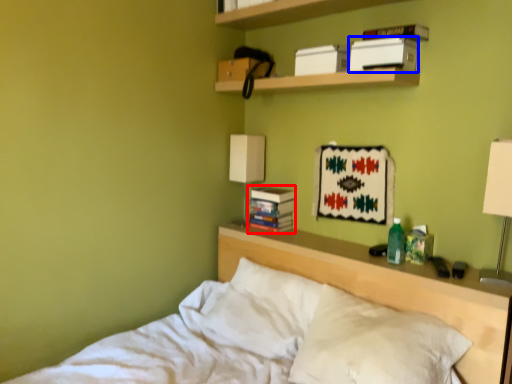
Question: Among these objects, which one is farthest to the camera, paperback book (highlighted by a red box) or paperback book (highlighted by a blue box)?

Choices:
 (A) paperback book
 (B) paperback book

Answer: (A)